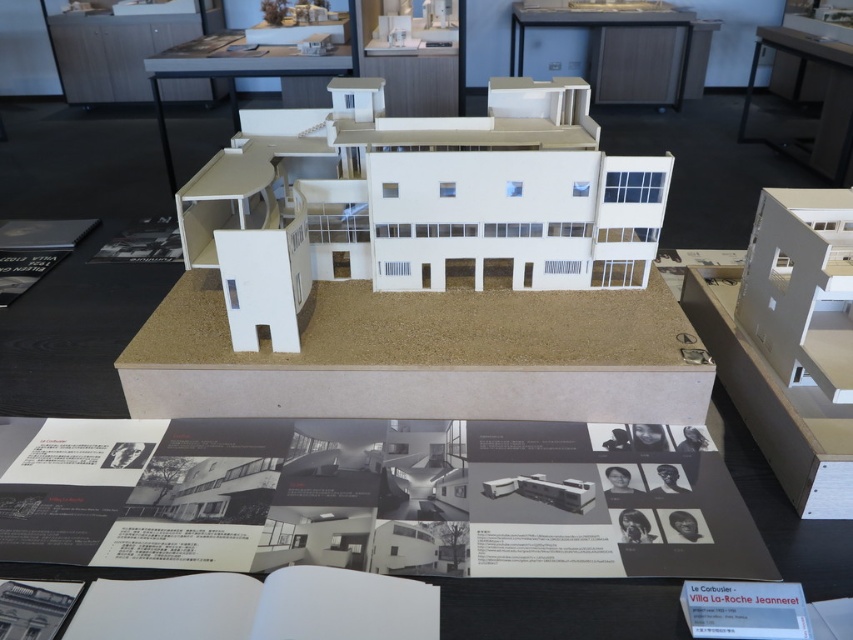
Question: Where is white matte table at upper center located in relation to black glossy table at upper right in the image?

Choices:
 (A) left
 (B) right

Answer: (A)

Question: Which point is closer to the camera taking this photo?

Choices:
 (A) (689, 64)
 (B) (836, 88)

Answer: (B)

Question: Which object is the closest to the white matte table at upper center?

Choices:
 (A) black glossy table at upper right
 (B) black paper book at center
 (C) light brown wooden table at upper center

Answer: (C)

Question: Can you confirm if black paper book at center is positioned below matte black book at upper left?

Choices:
 (A) yes
 (B) no

Answer: (A)

Question: Is black paper book at center to the left of white matte table at upper center from the viewer's perspective?

Choices:
 (A) no
 (B) yes

Answer: (A)

Question: Which of these objects is positioned closest to the matte black book at upper left?

Choices:
 (A) black glossy table at upper right
 (B) white matte table at upper center
 (C) black paper book at center

Answer: (C)